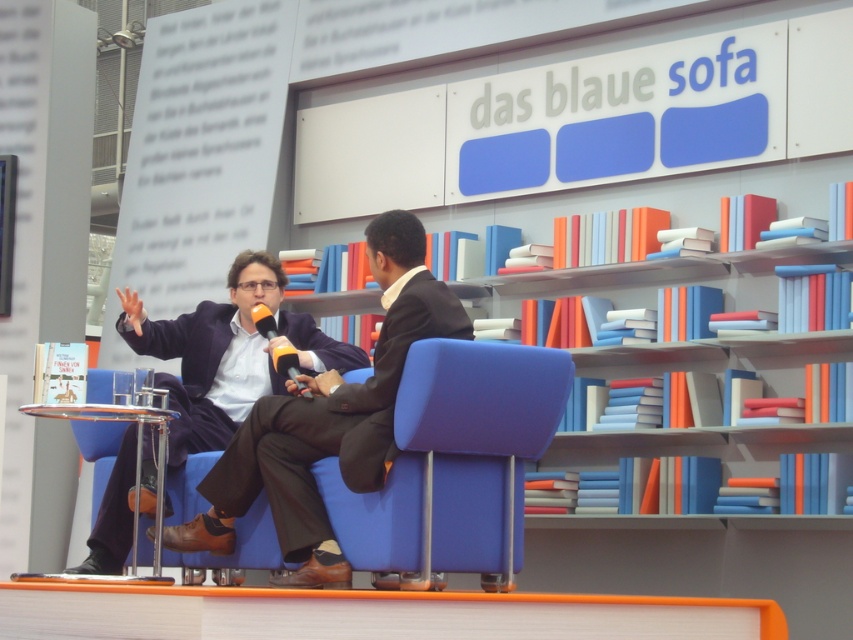
You are a photographer at the event and need to adjust the lighting so that the person in the dark brown woolen suit at center and the dark blue fabric business suit at center are both well lit. Which person should you adjust the light towards first to ensure both are properly illuminated?

You should adjust the light towards the dark blue fabric business suit at center first since the dark brown woolen suit at center is to the right of it, allowing the light to cover both areas effectively.

You are a photographer at the event and need to capture a closeup shot of both the dark brown woolen suit at center and the matte yellow microphone at center. The camera you are using has a maximum focus range of 17 inches. Can you fit both objects within the focus range without moving the camera?

The dark brown woolen suit at center and the matte yellow microphone at center are 16.95 inches apart. Since the distance between them is less than the camera maximum focus range of 17 inches, you can fit both objects within the focus range without moving the camera.

You are standing in front of the sofa at the book fair and want to place a small plant between the two points marked as point (358, 392) and point (297, 387). Which point should the plant be closer to so it is nearer to the viewer?

The plant should be placed closer to point (358, 392) because it is closer to the viewer than point (297, 387).